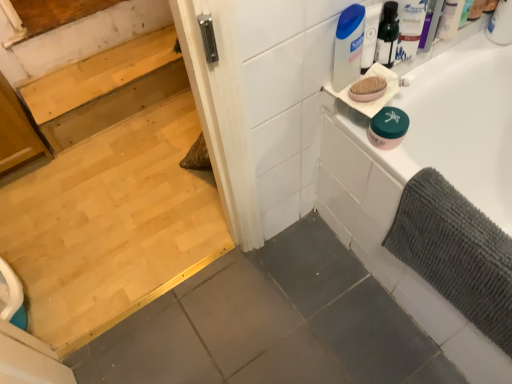
What do you see at coordinates (458, 125) in the screenshot?
I see `white glossy bathtub at upper right` at bounding box center [458, 125].

Measure the distance between gray textured bath mat at right and camera.

gray textured bath mat at right and camera are 32.76 inches apart.

Describe the element at coordinates (368, 89) in the screenshot. I see `pink matte oval soap at upper right` at that location.

Identify the location of light brown wood stairs at upper left. The image size is (512, 384). point(105,88).

Find the location of a particular element. white plastic container at upper right is located at coordinates click(x=450, y=19).

Identify the location of stair directly beneath the gray textured bath mat at right (from a real-world perspective). (105, 88).

How many degrees apart are the facing directions of gray textured bath mat at right and light brown wood stairs at upper left?

They differ by 89 degrees in their facing directions.

Which is farther from the camera, [440,212] or [143,69]?

The point [143,69] is behind.

Is gray textured bath mat at right closer to camera compared to light brown wood stairs at upper left?

Yes, gray textured bath mat at right is in front of light brown wood stairs at upper left.

Looking at their sizes, would you say white plastic container at upper right is wider or thinner than white plastic container at upper right?

white plastic container at upper right is wider than white plastic container at upper right.

Consider the image. Is white plastic container at upper right facing away from white plastic container at upper right?

white plastic container at upper right is not turned away from white plastic container at upper right.

Between white plastic container at upper right and white plastic container at upper right, which one has less height?

white plastic container at upper right is shorter.

Is white plastic container at upper right located outside white plastic container at upper right?

Yes, white plastic container at upper right is located beyond the bounds of white plastic container at upper right.

Looking at this image, from the image's perspective, is gray textured bath mat at right located above or below pink matte oval soap at upper right?

From the image's perspective, gray textured bath mat at right appears below pink matte oval soap at upper right.

Looking at the image, does gray textured bath mat at right seem bigger or smaller compared to pink matte oval soap at upper right?

In the image, gray textured bath mat at right appears to be larger than pink matte oval soap at upper right.

Considering the points (487, 270) and (349, 89), which point is behind, point (487, 270) or point (349, 89)?

The point (349, 89) is farther from the camera.

Can you confirm if light brown wood stairs at upper left is positioned to the left of green matte jar at upper right?

Indeed, light brown wood stairs at upper left is positioned on the left side of green matte jar at upper right.

How different are the orientations of light brown wood stairs at upper left and green matte jar at upper right in degrees?

0.192 degrees.

Does light brown wood stairs at upper left contain green matte jar at upper right?

No, light brown wood stairs at upper left does not contain green matte jar at upper right.

Consider the image. From a real-world perspective, is light brown wood stairs at upper left positioned under green matte jar at upper right based on gravity?

Yes, from a real-world perspective, light brown wood stairs at upper left is below green matte jar at upper right.

How far apart are pink matte oval soap at upper right and light brown wood stairs at upper left?

pink matte oval soap at upper right and light brown wood stairs at upper left are 4.02 feet apart from each other.

Who is taller, pink matte oval soap at upper right or light brown wood stairs at upper left?

light brown wood stairs at upper left is taller.

Is point (372, 81) behind point (75, 94)?

No, (372, 81) is in front of (75, 94).

Looking at this image, could you tell me if pink matte oval soap at upper right is turned towards light brown wood stairs at upper left?

No, pink matte oval soap at upper right does not turn towards light brown wood stairs at upper left.

Between point (382, 86) and point (386, 237), which one is positioned behind?

The point (386, 237) is behind.

Is pink matte oval soap at upper right spatially inside gray textured bath mat at right, or outside of it?

pink matte oval soap at upper right is outside gray textured bath mat at right.

Can you confirm if pink matte oval soap at upper right is smaller than gray textured bath mat at right?

Correct, pink matte oval soap at upper right occupies less space than gray textured bath mat at right.

Is pink matte oval soap at upper right oriented away from gray textured bath mat at right?

No, pink matte oval soap at upper right's orientation is not away from gray textured bath mat at right.

Which object is more forward, green matte jar at upper right or white glossy bathtub at upper right?

white glossy bathtub at upper right is closer to the camera.

At what (x,y) coordinates should I click in order to perform the action: click on product above the white glossy bathtub at upper right (from a real-world perspective). Please return your answer as a coordinate pair (x, y). This screenshot has width=512, height=384. Looking at the image, I should click on (388, 128).

From the image's perspective, which one is positioned lower, green matte jar at upper right or white glossy bathtub at upper right?

From the image's view, white glossy bathtub at upper right is below.

Between green matte jar at upper right and white glossy bathtub at upper right, which one appears on the right side from the viewer's perspective?

white glossy bathtub at upper right.

I want to click on stair that appears below the gray textured bath mat at right (from a real-world perspective), so click(x=105, y=88).

In order to click on cleaning product that is below the white plastic container at upper right (from the image's perspective) in this screenshot , I will do point(348,46).

When comparing their distances from pink matte oval soap at upper right, does gray textured bath mat at right or white glossy bathtub at upper right seem further?

Among the two, white glossy bathtub at upper right is located further to pink matte oval soap at upper right.

Based on their spatial positions, is white plastic container at upper right or green matte jar at upper right closer to pink matte oval soap at upper right?

green matte jar at upper right is closer to pink matte oval soap at upper right.

Estimate the real-world distances between objects in this image. Which object is closer to light brown wood stairs at upper left, green matte jar at upper right or gray textured bath mat at right?

Among the two, green matte jar at upper right is located nearer to light brown wood stairs at upper left.

Looking at the image, which one is located further to green matte jar at upper right, pink matte oval soap at upper right or white glossy bathtub at upper right?

white glossy bathtub at upper right is positioned further to the anchor green matte jar at upper right.

From the picture: Considering their positions, is white glossy bathtub at upper right positioned closer to pink matte oval soap at upper right than white plastic container at upper right?

Among the two, white plastic container at upper right is located nearer to pink matte oval soap at upper right.

Looking at the image, which one is located further to white glossy bathtub at upper right, gray textured bath mat at right or pink matte oval soap at upper right?

pink matte oval soap at upper right.

Based on their spatial positions, is white plastic container at upper right or white plastic container at upper right closer to gray textured bath mat at right?

Among the two, white plastic container at upper right is located nearer to gray textured bath mat at right.

From the image, which object appears to be nearer to pink matte oval soap at upper right, white plastic container at upper right or white plastic container at upper right?

white plastic container at upper right lies closer to pink matte oval soap at upper right than the other object.

Where is `cleaning product located between light brown wood stairs at upper left and white glossy bathtub at upper right in the left-right direction`? cleaning product located between light brown wood stairs at upper left and white glossy bathtub at upper right in the left-right direction is located at coordinates (348, 46).

Locate an element on the screen. Image resolution: width=512 pixels, height=384 pixels. product between white plastic container at upper right and white glossy bathtub at upper right from top to bottom is located at coordinates (388, 128).

Identify the location of product between white plastic container at upper right and gray textured bath mat at right vertically. The height and width of the screenshot is (384, 512). (388, 128).

Locate an element on the screen. The image size is (512, 384). toiletry between light brown wood stairs at upper left and white glossy bathtub at upper right in the horizontal direction is located at coordinates (450, 19).